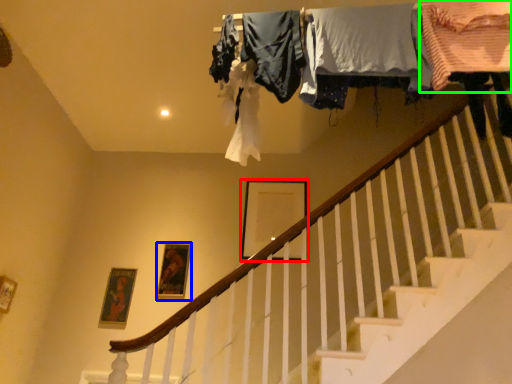
Question: Which object is positioned closest to picture frame (highlighted by a red box)? Select from picture frame (highlighted by a blue box) and clothing (highlighted by a green box).

Choices:
 (A) picture frame
 (B) clothing

Answer: (A)